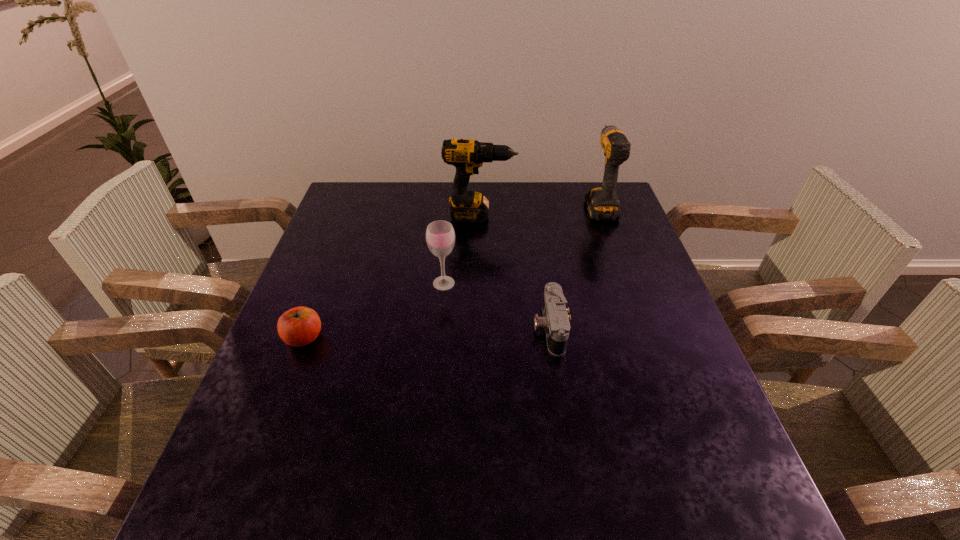
The image size is (960, 540). In order to click on unoccupied position between the left drill and the third farthest object in this screenshot , I will do `click(462, 249)`.

Locate an element on the screen. The width and height of the screenshot is (960, 540). vacant area that lies between the second object from right to left and the right drill is located at coordinates (574, 266).

You are a GUI agent. You are given a task and a screenshot of the screen. Output one action in this format:
    pyautogui.click(x=<x>, y=<y>)
    Task: Click on the empty location between the left drill and the third shortest object
    The width and height of the screenshot is (960, 540).
    Given the screenshot: What is the action you would take?
    pyautogui.click(x=462, y=249)

The width and height of the screenshot is (960, 540). Identify the location of object that is the second closest to the rightmost object. (555, 321).

Identify which object is located as the nearest to the left drill. Please provide its 2D coordinates. Your answer should be formatted as a tuple, i.e. [(x, y)], where the tuple contains the x and y coordinates of a point satisfying the conditions above.

[(602, 203)]

Where is `free spot that satisfies the following two spatial constraints: 1. at the tip of the left drill; 2. on the front side of the wineglass`? free spot that satisfies the following two spatial constraints: 1. at the tip of the left drill; 2. on the front side of the wineglass is located at coordinates (480, 283).